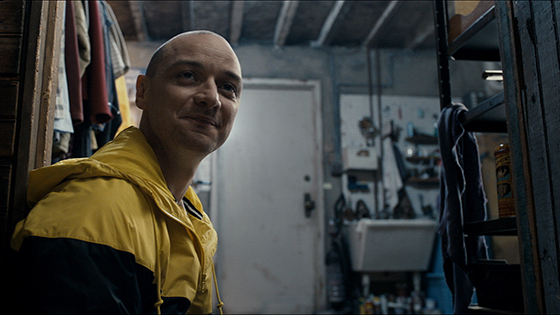
Identify the location of wall. The height and width of the screenshot is (315, 560). [408, 78], [294, 68].